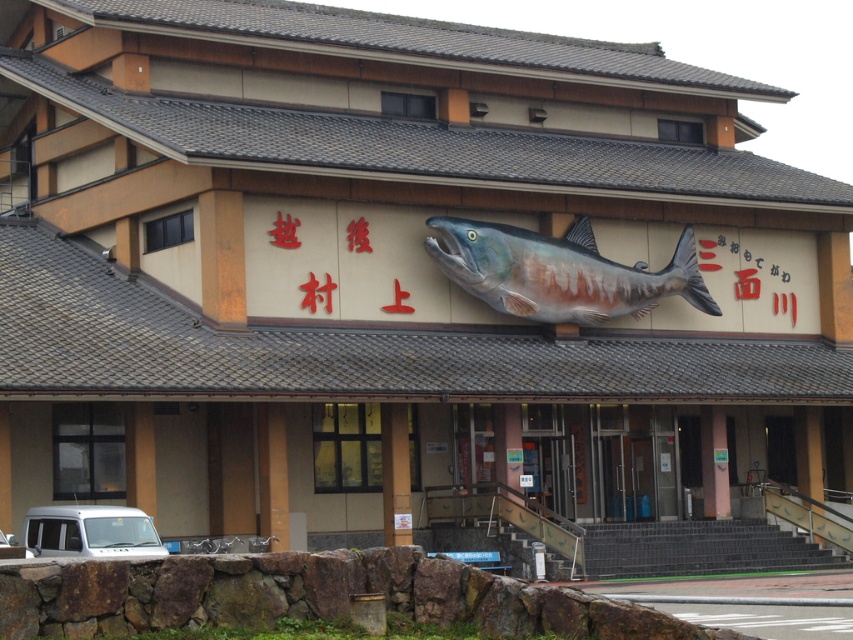
Between shiny metallic fish at center and silver metallic van at lower left, which one is positioned higher?

shiny metallic fish at center is above.

Between point (521, 241) and point (39, 540), which one is positioned in front?

Point (39, 540) is in front.

The width and height of the screenshot is (853, 640). What do you see at coordinates (560, 273) in the screenshot?
I see `shiny metallic fish at center` at bounding box center [560, 273].

This screenshot has width=853, height=640. Find the location of `shiny metallic fish at center`. shiny metallic fish at center is located at coordinates (560, 273).

Is silver metallic van at lower left to the left of white matte van at lower left from the viewer's perspective?

No, silver metallic van at lower left is not to the left of white matte van at lower left.

Based on the photo, is silver metallic van at lower left wider than white matte van at lower left?

Incorrect, silver metallic van at lower left's width does not surpass white matte van at lower left's.

Is point (82, 550) positioned before point (0, 554)?

That is False.

You are a GUI agent. You are given a task and a screenshot of the screen. Output one action in this format:
    pyautogui.click(x=<x>, y=<y>)
    Task: Click on the silver metallic van at lower left
    
    Given the screenshot: What is the action you would take?
    pyautogui.click(x=90, y=531)

The width and height of the screenshot is (853, 640). What are the coordinates of `shiny metallic fish at center` in the screenshot? It's located at (560, 273).